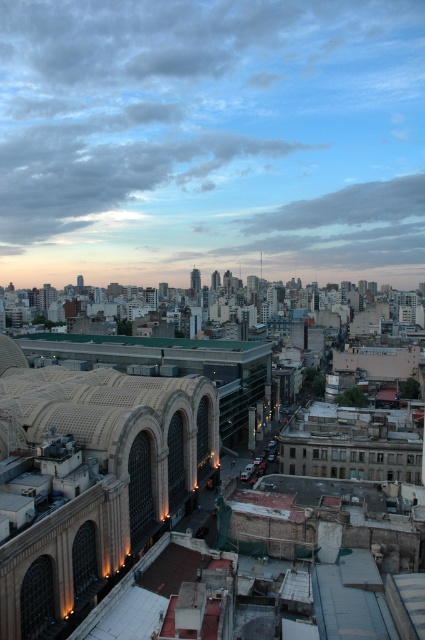
Who is positioned more to the right, cloudy sky at upper center or green matte roof at center?

cloudy sky at upper center is more to the right.

Can you confirm if cloudy sky at upper center is thinner than green matte roof at center?

Incorrect, cloudy sky at upper center's width is not less than green matte roof at center's.

Which is behind, point (210, 161) or point (93, 340)?

The point (210, 161) is behind.

At what (x,y) coordinates should I click in order to perform the action: click on cloudy sky at upper center. Please return your answer as a coordinate pair (x, y). Looking at the image, I should click on (212, 138).

Who is higher up, brick building at center or green matte roof at center?

green matte roof at center is above.

Who is positioned more to the right, brick building at center or green matte roof at center?

brick building at center is more to the right.

Describe the element at coordinates (107, 458) in the screenshot. I see `brick building at center` at that location.

Identify the location of brick building at center. Image resolution: width=425 pixels, height=640 pixels. (107, 458).

Which is below, cloudy sky at upper center or brick building at center?

brick building at center is below.

Does cloudy sky at upper center have a smaller size compared to brick building at center?

No, cloudy sky at upper center is not smaller than brick building at center.

Which is in front, point (172, 93) or point (121, 358)?

Point (121, 358) is more forward.

The height and width of the screenshot is (640, 425). What are the coordinates of `cloudy sky at upper center` in the screenshot? It's located at (212, 138).